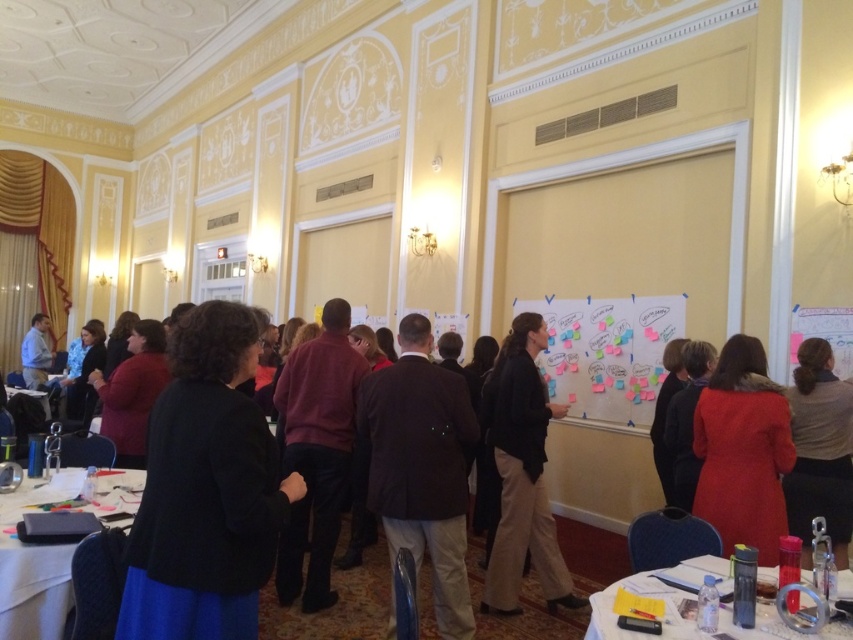
Question: Observing the image, what is the correct spatial positioning of brown leather jacket at center in reference to matte blue shirt at left?

Choices:
 (A) left
 (B) right

Answer: (B)

Question: Is black matte jacket at center behind matte blue shirt at left?

Choices:
 (A) no
 (B) yes

Answer: (A)

Question: Estimate the real-world distances between objects in this image. Which object is closer to the matte red coat at lower right?

Choices:
 (A) white matte whiteboard at center
 (B) brown leather jacket at center
 (C) white plastic table at lower left
 (D) gray fabric jacket at center

Answer: (D)

Question: Which object is the farthest from the white matte whiteboard at center?

Choices:
 (A) matte red coat at lower right
 (B) gray fabric jacket at center

Answer: (A)

Question: Which point appears farthest from the camera in this image?

Choices:
 (A) (711, 564)
 (B) (123, 472)
 (C) (454, 516)
 (D) (817, 365)

Answer: (D)

Question: Does black matte jacket at center have a greater width compared to khaki pants at center?

Choices:
 (A) no
 (B) yes

Answer: (A)